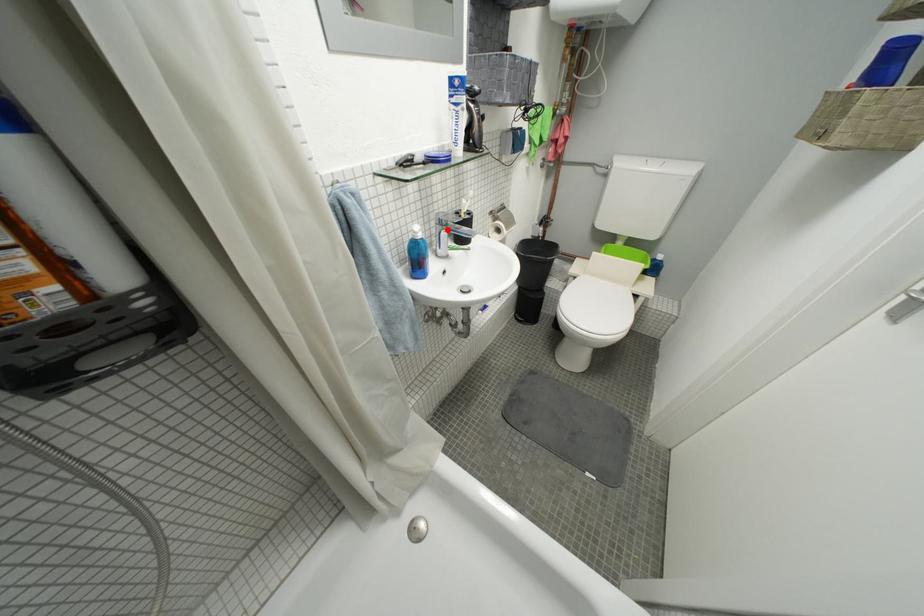
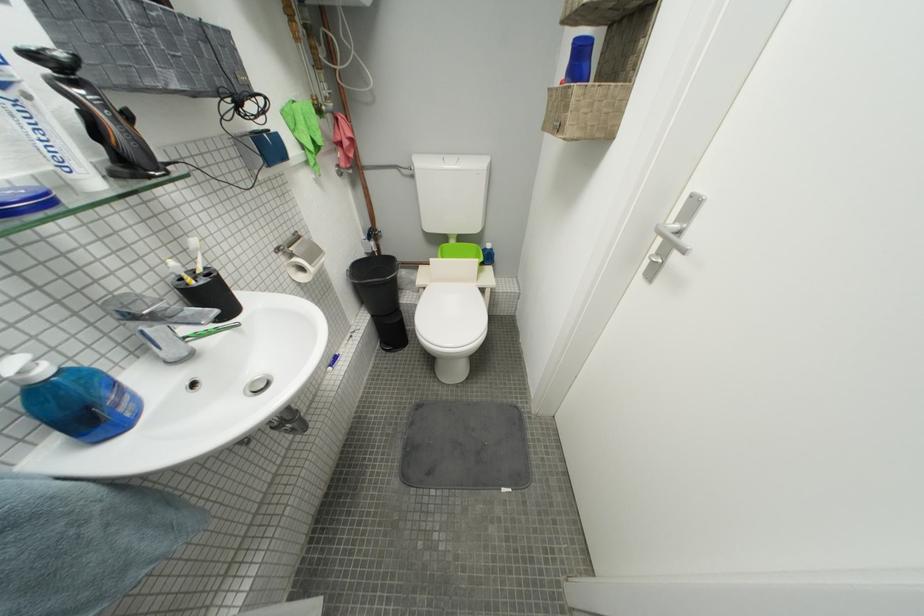
The point at the highlighted location is marked in the first image. Where is the corresponding point in the second image?

(139, 325)